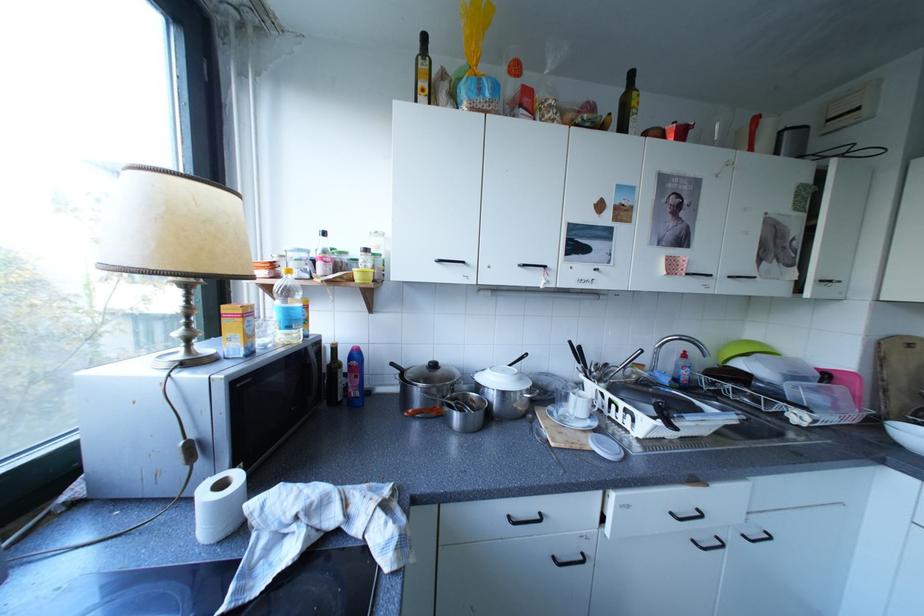
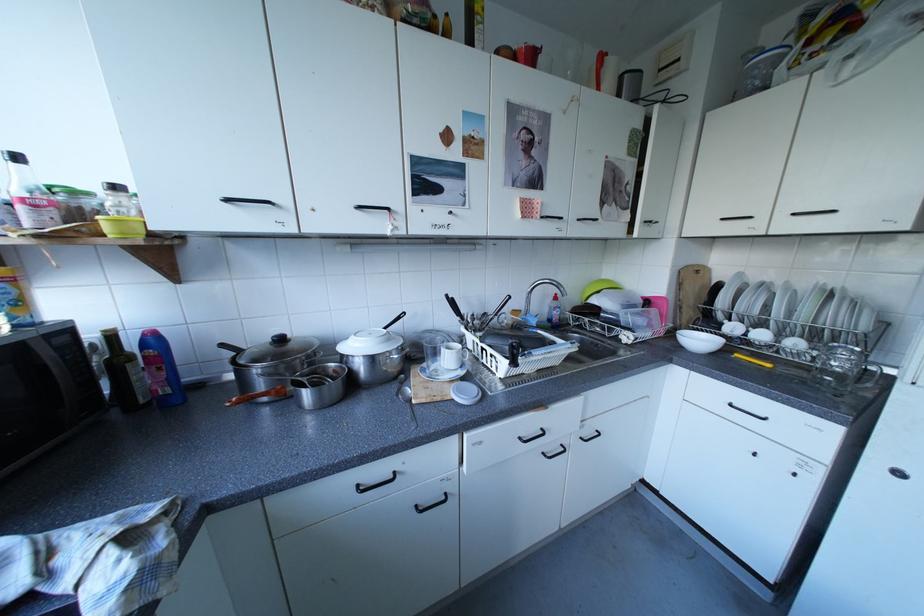
Locate, in the second image, the point that corresponds to [757,536] in the first image.

(593, 439)